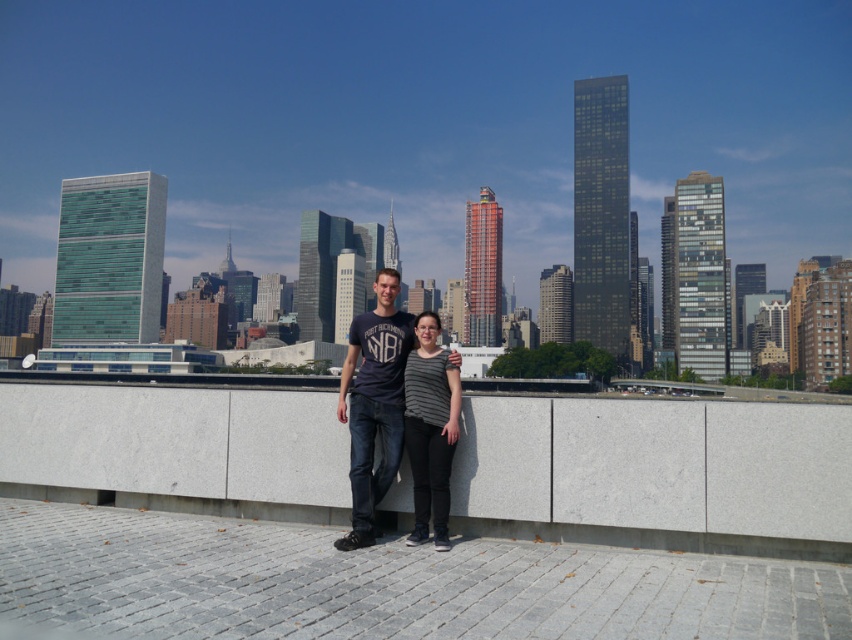
Question: Does dark blue jeans at center have a larger size compared to striped fabric shirt at center?

Choices:
 (A) no
 (B) yes

Answer: (B)

Question: From the image, what is the correct spatial relationship of dark blue jeans at center in relation to striped fabric shirt at center?

Choices:
 (A) above
 (B) below

Answer: (B)

Question: Among these points, which one is nearest to the camera?

Choices:
 (A) (343, 397)
 (B) (432, 444)

Answer: (B)

Question: Observing the image, what is the correct spatial positioning of dark blue jeans at center in reference to striped fabric shirt at center?

Choices:
 (A) right
 (B) left

Answer: (B)

Question: Which of the following is the farthest from the observer?

Choices:
 (A) (445, 385)
 (B) (371, 516)

Answer: (A)